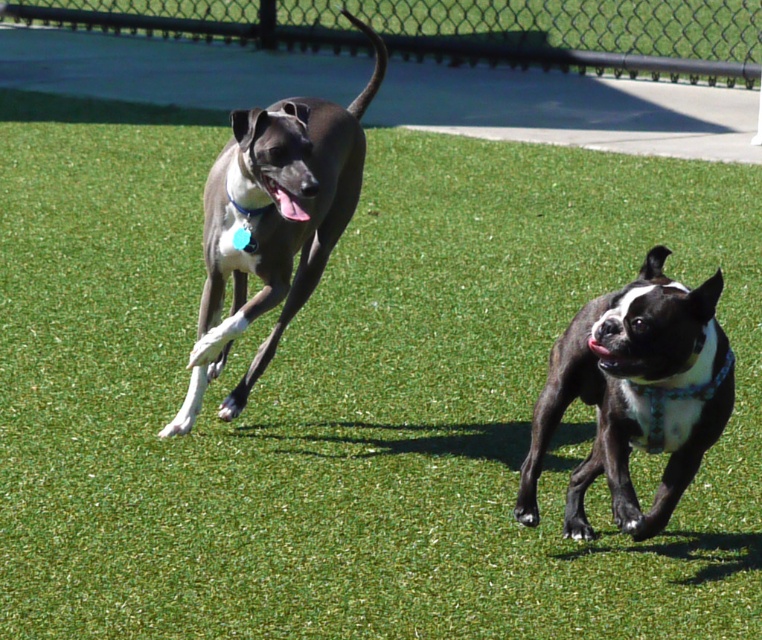
Based on the photo, can you confirm if green artificial turf at upper center is positioned to the right of smooth gray dog at left?

In fact, green artificial turf at upper center is to the left of smooth gray dog at left.

Looking at this image, who is more distant from viewer, (253, 35) or (258, 259)?

The point (253, 35) is more distant.

At what (x,y) coordinates should I click in order to perform the action: click on green artificial turf at upper center. Please return your answer as a coordinate pair (x, y). The width and height of the screenshot is (762, 640). Looking at the image, I should click on (578, 33).

Is pink glossy tongue at center above blue fabric neckband at upper left?

No, pink glossy tongue at center is not above blue fabric neckband at upper left.

What do you see at coordinates (283, 202) in the screenshot? I see `pink glossy tongue at center` at bounding box center [283, 202].

Where is `pink glossy tongue at center`? pink glossy tongue at center is located at coordinates [x=283, y=202].

Who is higher up, blue fabric neckband at right or black glossy mouth at lower right?

black glossy mouth at lower right is above.

Between blue fabric neckband at right and black glossy mouth at lower right, which one has more height?

With more height is blue fabric neckband at right.

Where is `blue fabric neckband at right`? This screenshot has width=762, height=640. blue fabric neckband at right is located at coordinates (684, 387).